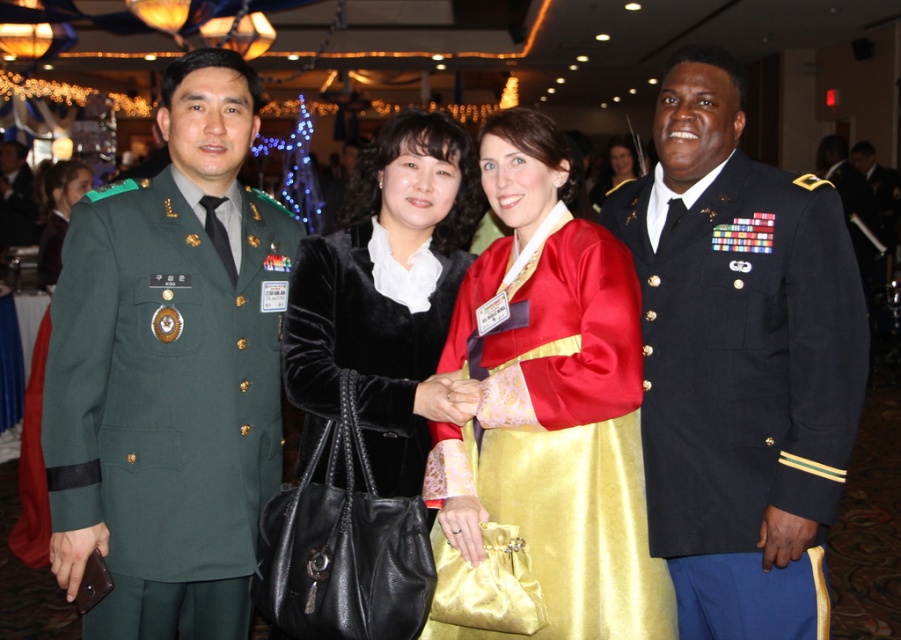
Between satin kimono at center and velvet black coat at center, which one appears on the right side from the viewer's perspective?

From the viewer's perspective, satin kimono at center appears more on the right side.

Is point (481, 429) in front of point (397, 422)?

No, (481, 429) is behind (397, 422).

I want to click on satin kimono at center, so click(551, 397).

Identify the location of satin kimono at center. The width and height of the screenshot is (901, 640). (551, 397).

Consider the image. Who is positioned more to the left, shiny black uniform at right or velvet black coat at upper left?

velvet black coat at upper left

The height and width of the screenshot is (640, 901). Find the location of `shiny black uniform at right`. shiny black uniform at right is located at coordinates (740, 362).

Find the location of a particular element. This screenshot has height=640, width=901. shiny black uniform at right is located at coordinates (740, 362).

Which is in front, point (70, 193) or point (629, 168)?

Point (70, 193) is in front.

Which is behind, point (37, 276) or point (613, 186)?

Positioned behind is point (613, 186).

Does point (65, 211) come closer to viewer compared to point (605, 173)?

Yes, point (65, 211) is in front of point (605, 173).

Find the location of a particular element. velvet black coat at upper left is located at coordinates (58, 214).